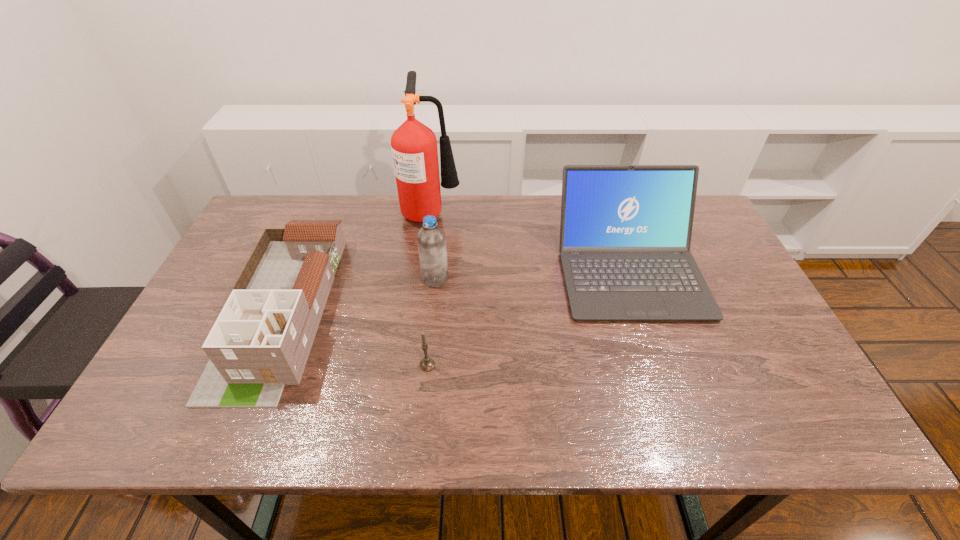
At what (x,y) coordinates should I click in order to perform the action: click on free space between the candle and the water bottle. Please return your answer as a coordinate pair (x, y). The width and height of the screenshot is (960, 540). Looking at the image, I should click on (431, 322).

The width and height of the screenshot is (960, 540). Find the location of `empty location between the tallest object and the dollhouse`. empty location between the tallest object and the dollhouse is located at coordinates 356,261.

Locate an element on the screen. The image size is (960, 540). free space between the laptop computer and the dollhouse is located at coordinates (455, 290).

This screenshot has height=540, width=960. I want to click on object that is the second closest to the rightmost object, so (431, 239).

Select which object is the fourth closest to the rightmost object. Please provide its 2D coordinates. Your answer should be formatted as a tuple, i.e. [(x, y)], where the tuple contains the x and y coordinates of a point satisfying the conditions above.

[(261, 340)]

I want to click on vacant position in the image that satisfies the following two spatial constraints: 1. at the nozzle of the water bottle; 2. on the right side of the fire extinguisher, so click(423, 279).

Identify the location of vacant space that satisfies the following two spatial constraints: 1. at the nozzle of the candle; 2. on the right side of the fire extinguisher. (412, 365).

Image resolution: width=960 pixels, height=540 pixels. I want to click on vacant point that satisfies the following two spatial constraints: 1. at the nozzle of the water bottle; 2. on the left side of the fire extinguisher, so (x=423, y=279).

Identify the location of free location that satisfies the following two spatial constraints: 1. at the nozzle of the tallest object; 2. on the left side of the water bottle. (423, 279).

Locate an element on the screen. free spot that satisfies the following two spatial constraints: 1. at the nozzle of the tallest object; 2. on the back side of the candle is located at coordinates (412, 365).